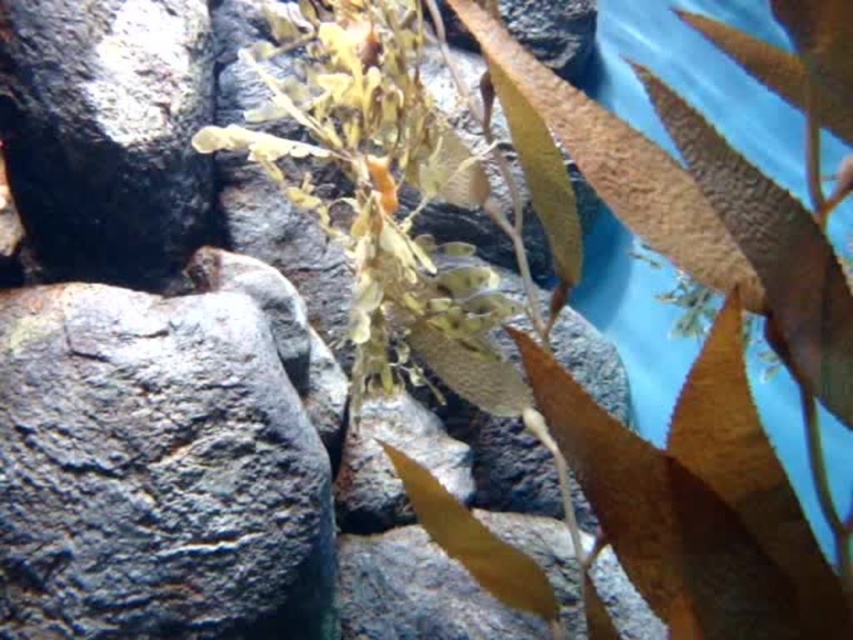
Is gray rough rock at left in front of black matte rock at upper left?

Yes.

Is the position of gray rough rock at left more distant than that of black matte rock at upper left?

No, it is not.

This screenshot has height=640, width=853. I want to click on gray rough rock at left, so click(157, 472).